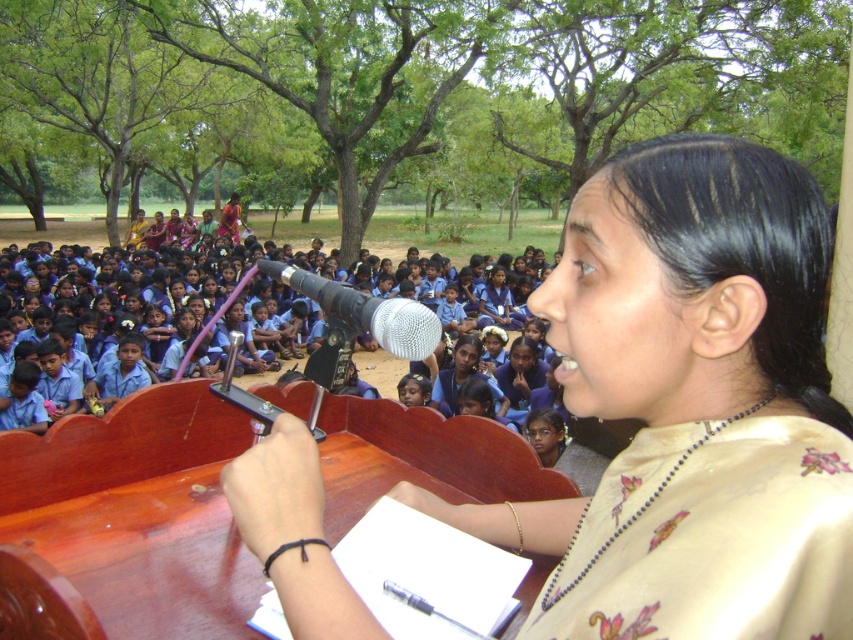
Where is `silk sari at center`? silk sari at center is located at coordinates (692, 404).

Locate an element on the screen. This screenshot has width=853, height=640. silk sari at center is located at coordinates [x=692, y=404].

Locate an element on the screen. This screenshot has width=853, height=640. silk sari at center is located at coordinates (692, 404).